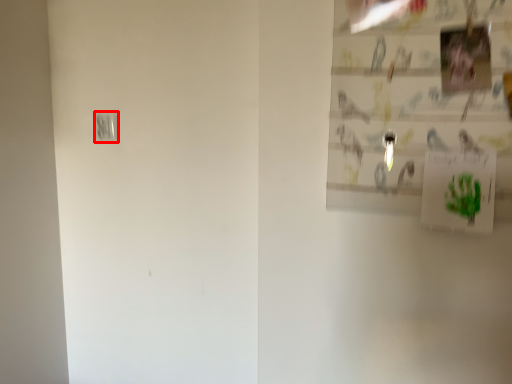
Question: From the image's perspective, what is the correct spatial relationship of light switch (annotated by the red box) in relation to postcard?

Choices:
 (A) above
 (B) below

Answer: (A)